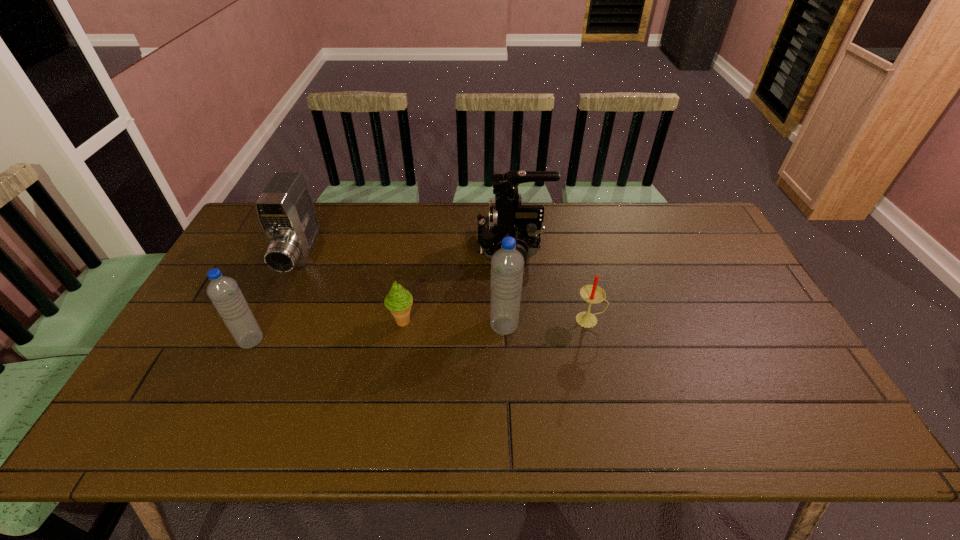
Find the location of `vacant region that satisfies the following two spatial constraints: 1. at the front of the left camcorder, highlighting the lens; 2. on the right side of the icecream`. vacant region that satisfies the following two spatial constraints: 1. at the front of the left camcorder, highlighting the lens; 2. on the right side of the icecream is located at coordinates (270, 322).

Find the location of a particular element. The width and height of the screenshot is (960, 540). free space that satisfies the following two spatial constraints: 1. at the front of the fourth object from right to left, highlighting the lens; 2. on the right side of the shorter camcorder is located at coordinates (270, 322).

Where is `vacant area that satisfies the following two spatial constraints: 1. at the front of the fourth object from right to left, highlighting the lens; 2. on the right side of the left camcorder`? vacant area that satisfies the following two spatial constraints: 1. at the front of the fourth object from right to left, highlighting the lens; 2. on the right side of the left camcorder is located at coordinates (270, 322).

This screenshot has height=540, width=960. I want to click on vacant space that satisfies the following two spatial constraints: 1. at the front of the shorter camcorder, highlighting the lens; 2. on the left side of the fourth object from right to left, so click(x=270, y=322).

The height and width of the screenshot is (540, 960). Find the location of `blank area in the image that satisfies the following two spatial constraints: 1. at the front of the shorter camcorder, highlighting the lens; 2. on the left side of the rightmost object`. blank area in the image that satisfies the following two spatial constraints: 1. at the front of the shorter camcorder, highlighting the lens; 2. on the left side of the rightmost object is located at coordinates (271, 320).

Find the location of a particular element. The height and width of the screenshot is (540, 960). vacant space that satisfies the following two spatial constraints: 1. on the back side of the candle; 2. on the right side of the third object from left to right is located at coordinates (402, 320).